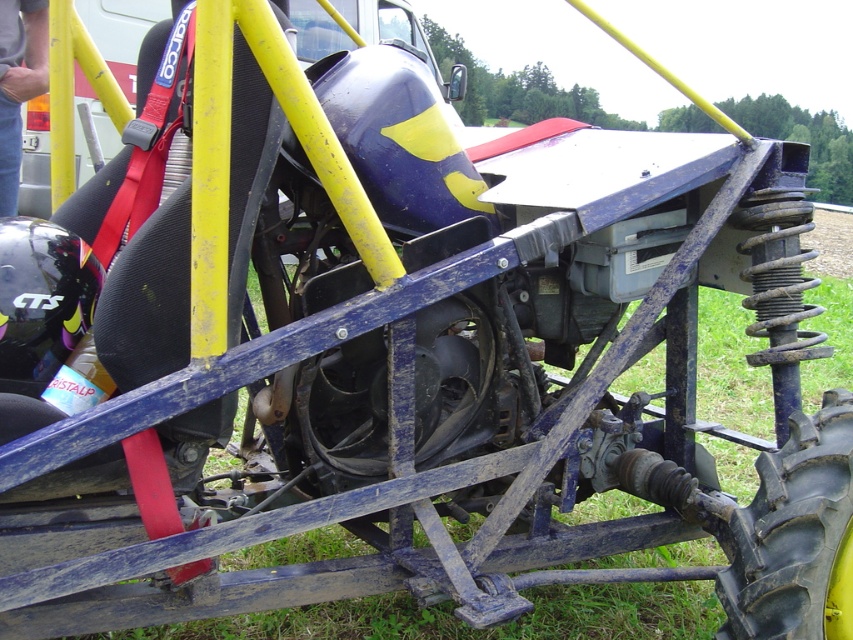
Question: Does green grass at lower center appear under black rubber tire at lower right?

Choices:
 (A) no
 (B) yes

Answer: (A)

Question: Does green grass at lower center appear over black rubber tire at lower right?

Choices:
 (A) yes
 (B) no

Answer: (A)

Question: Which of the following is the closest to the observer?

Choices:
 (A) (711, 561)
 (B) (759, 632)

Answer: (B)

Question: Can you confirm if green grass at lower center is positioned to the right of black rubber tire at lower right?

Choices:
 (A) no
 (B) yes

Answer: (B)